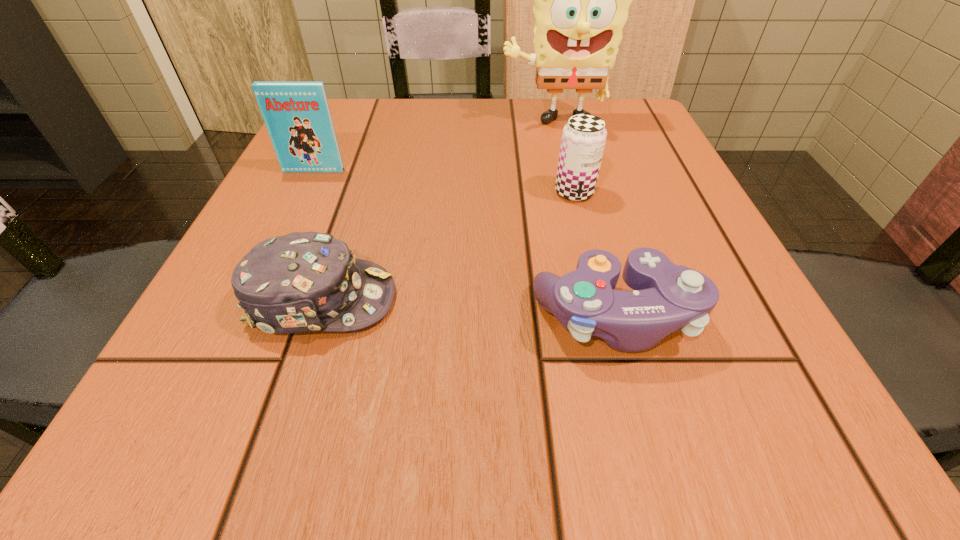
At what (x,y) coordinates should I click in order to perform the action: click on free space that satisfies the following two spatial constraints: 1. on the face of the tallest object; 2. on the left side of the control. Please return your answer as a coordinate pair (x, y). Looking at the image, I should click on (601, 318).

I want to click on free region that satisfies the following two spatial constraints: 1. on the face of the tallest object; 2. on the right side of the control, so click(601, 318).

Find the location of a particular element. The height and width of the screenshot is (540, 960). blank space that satisfies the following two spatial constraints: 1. on the face of the tallest object; 2. on the front-facing side of the headwear is located at coordinates (596, 300).

The width and height of the screenshot is (960, 540). Identify the location of free space that satisfies the following two spatial constraints: 1. on the front cover of the control; 2. on the left side of the second farthest object. (244, 318).